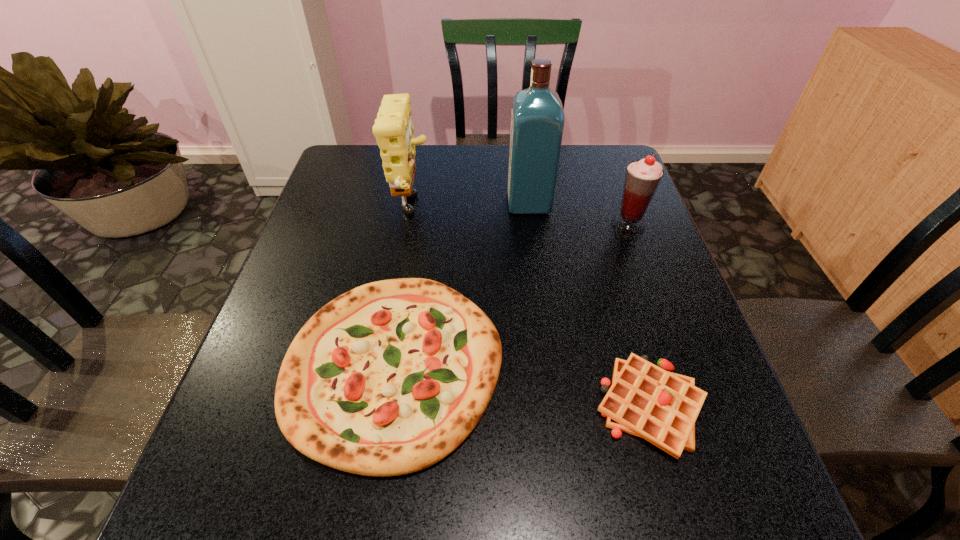
Where is `empty location between the smoothie and the tallest object`? The width and height of the screenshot is (960, 540). empty location between the smoothie and the tallest object is located at coordinates 579,214.

Identify the location of vacant space in between the pizza and the third object from left to right. (462, 284).

Where is `free area in between the liquor and the sponge`? Image resolution: width=960 pixels, height=540 pixels. free area in between the liquor and the sponge is located at coordinates (470, 207).

Locate an element on the screen. The image size is (960, 540). vacant area that lies between the third shortest object and the third object from left to right is located at coordinates pos(579,214).

The height and width of the screenshot is (540, 960). I want to click on vacant space in between the third tallest object and the waffle, so click(639, 316).

Locate an element on the screen. The image size is (960, 540). the third closest object to the pizza is located at coordinates (537, 117).

Point out which object is positioned as the third nearest to the sponge. Please provide its 2D coordinates. Your answer should be formatted as a tuple, i.e. [(x, y)], where the tuple contains the x and y coordinates of a point satisfying the conditions above.

[(642, 177)]

Image resolution: width=960 pixels, height=540 pixels. What are the coordinates of `vacant space that satisfies the following two spatial constraints: 1. on the flat label side of the tallest object; 2. on the right side of the smoothie` in the screenshot? It's located at (532, 226).

The width and height of the screenshot is (960, 540). What are the coordinates of `vacant point that satisfies the following two spatial constraints: 1. on the face of the sponge; 2. on the right side of the third shortest object` in the screenshot? It's located at (409, 226).

This screenshot has height=540, width=960. In order to click on vacant space that satisfies the following two spatial constraints: 1. on the flat label side of the liquor; 2. on the back side of the waffle in this screenshot , I will do `click(555, 407)`.